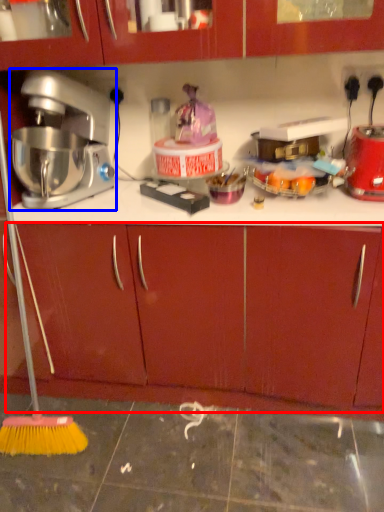
Question: Which object is further to the camera taking this photo, drawer (highlighted by a red box) or mixer (highlighted by a blue box)?

Choices:
 (A) drawer
 (B) mixer

Answer: (A)